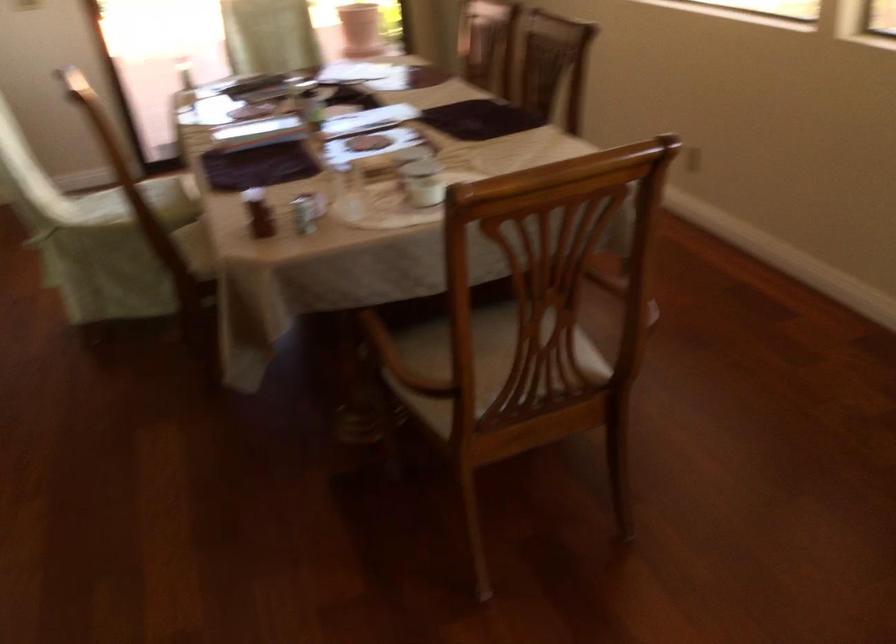
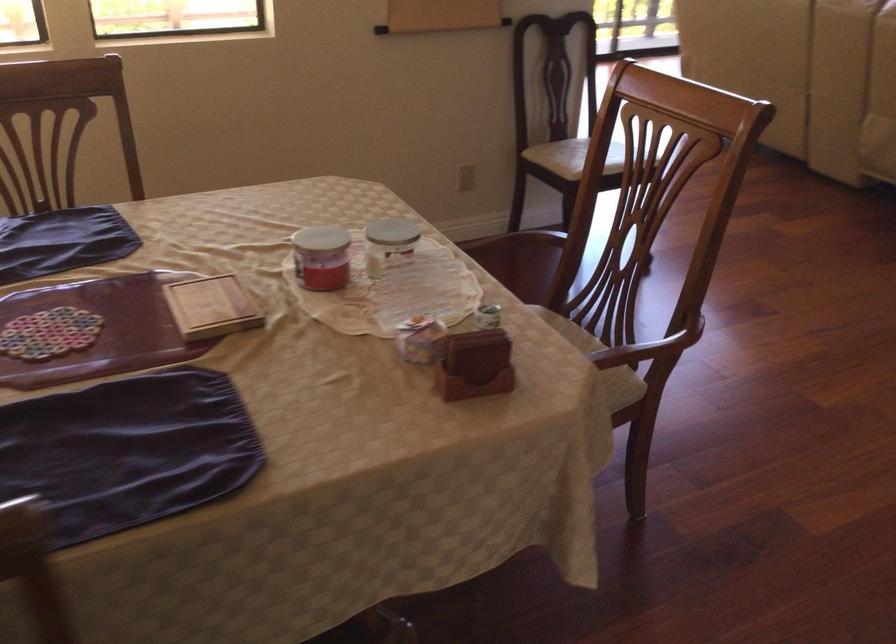
In the second image, find the point that corresponds to pixel 371 158 in the first image.

(211, 307)